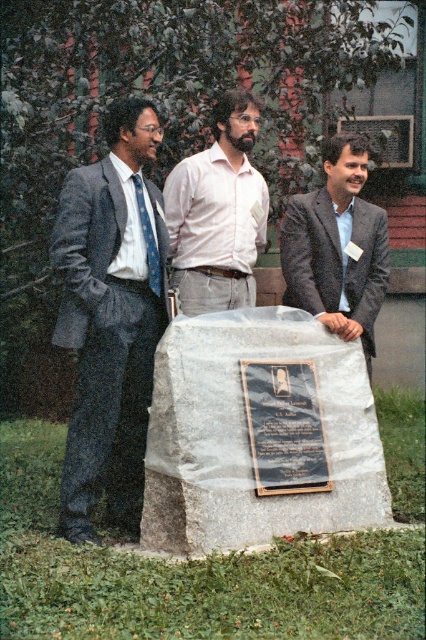
How much distance is there between white cotton shirt at center and matte gray suit at center?

25.92 inches

Can you confirm if white cotton shirt at center is bigger than matte gray suit at center?

Actually, white cotton shirt at center might be smaller than matte gray suit at center.

Does point (222, 124) lie behind point (377, 259)?

Yes, point (222, 124) is behind point (377, 259).

Where is `white cotton shirt at center`? This screenshot has width=426, height=640. white cotton shirt at center is located at coordinates (218, 212).

Who is shorter, matte gray suit at left or blue silk tie at left?

blue silk tie at left is shorter.

Locate an element on the screen. This screenshot has height=640, width=426. matte gray suit at left is located at coordinates (111, 317).

Is point (71, 180) farther from viewer compared to point (140, 182)?

No, it is not.

The height and width of the screenshot is (640, 426). Find the location of `matte gray suit at left`. matte gray suit at left is located at coordinates (111, 317).

Does gray polished stone at center appear on the right side of blue silk tie at left?

Indeed, gray polished stone at center is positioned on the right side of blue silk tie at left.

Measure the distance between gray polished stone at center and blue silk tie at left.

gray polished stone at center and blue silk tie at left are 1.19 meters apart from each other.

Is point (363, 404) positioned before point (154, 237)?

That is False.

This screenshot has width=426, height=640. What are the coordinates of `gray polished stone at center` in the screenshot? It's located at (259, 433).